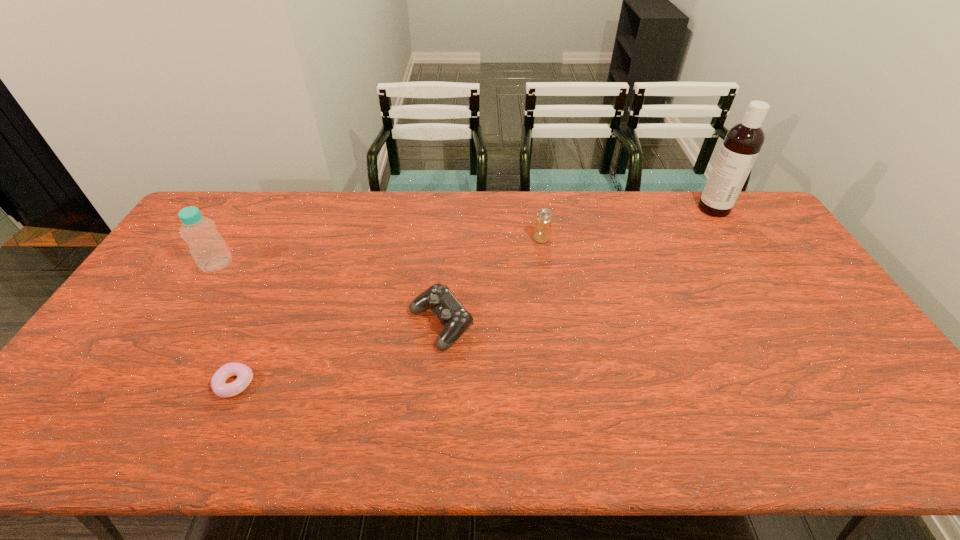
The image size is (960, 540). I want to click on free space that is in between the shortest object and the bottle, so click(226, 324).

The height and width of the screenshot is (540, 960). Identify the location of vacant area that lies between the tallest object and the second nearest object. (577, 267).

At what (x,y) coordinates should I click in order to perform the action: click on free area in between the third shortest object and the control. Please return your answer as a coordinate pair (x, y). This screenshot has height=540, width=960. Looking at the image, I should click on (492, 282).

The width and height of the screenshot is (960, 540). In order to click on free space between the control and the bottle in this screenshot , I will do `click(329, 294)`.

This screenshot has height=540, width=960. Find the location of `free spot between the fourth nearest object and the control`. free spot between the fourth nearest object and the control is located at coordinates (492, 282).

At what (x,y) coordinates should I click in order to perform the action: click on free space between the doughnut and the dishwasher detergent. Please return your answer as a coordinate pair (x, y). The image size is (960, 540). Looking at the image, I should click on (474, 296).

Identify which object is the fourth nearest to the saltshaker. Please provide its 2D coordinates. Your answer should be formatted as a tuple, i.e. [(x, y)], where the tuple contains the x and y coordinates of a point satisfying the conditions above.

[(207, 247)]

Image resolution: width=960 pixels, height=540 pixels. What are the coordinates of `object that ranks as the second closest to the farthest object` in the screenshot? It's located at (456, 319).

I want to click on vacant position in the image that satisfies the following two spatial constraints: 1. on the back side of the saltshaker; 2. on the left side of the fourth shortest object, so click(233, 239).

Find the location of a particular element. blank space that satisfies the following two spatial constraints: 1. on the front side of the control; 2. on the right side of the second tallest object is located at coordinates (180, 325).